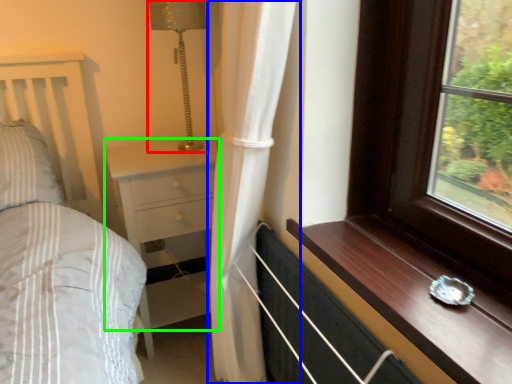
Question: Based on their relative distances, which object is farther from lamp (highlighted by a red box)? Choose from curtain (highlighted by a blue box) and chest of drawers (highlighted by a green box).

Choices:
 (A) curtain
 (B) chest of drawers

Answer: (A)